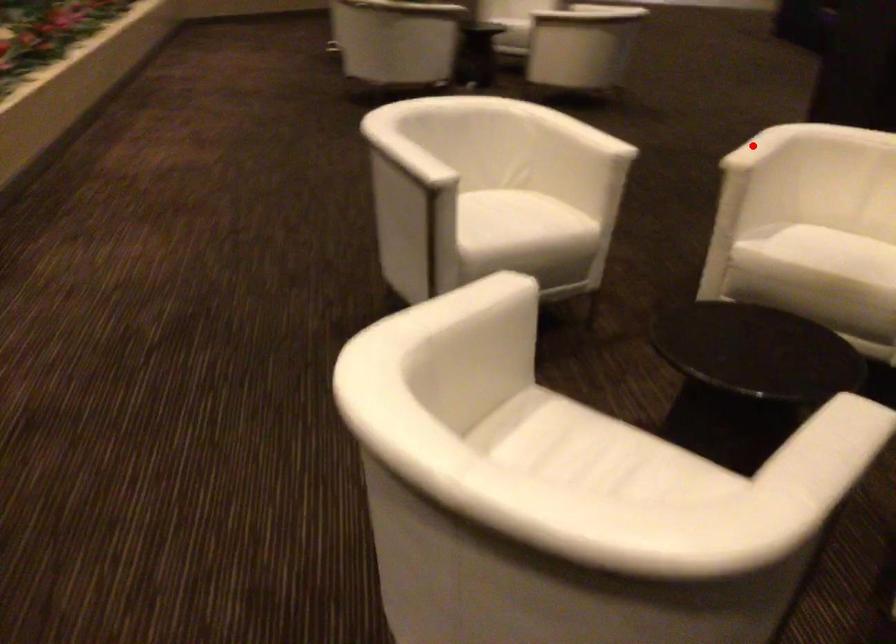
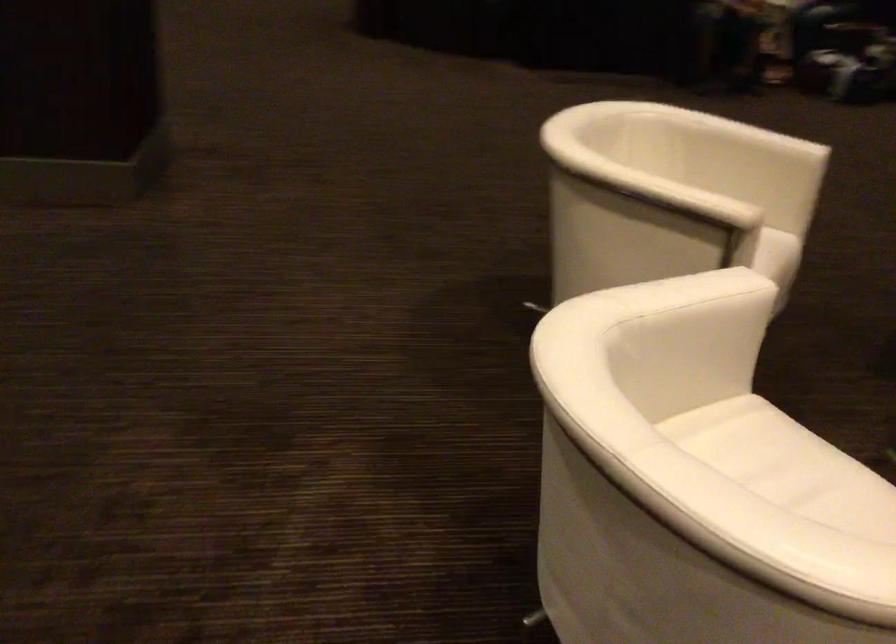
Locate, in the second image, the point that corresponds to the highlighted location in the first image.

(675, 194)